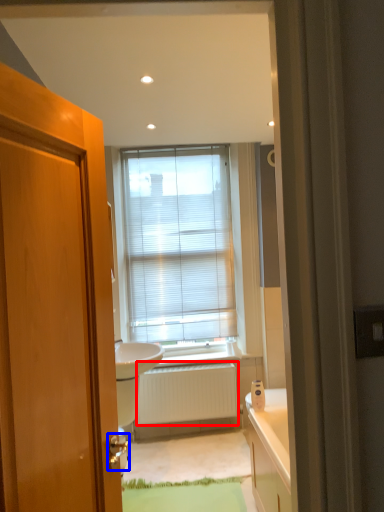
Question: Which object appears closest to the camera in this image, radiator (highlighted by a red box) or door handle (highlighted by a blue box)?

Choices:
 (A) radiator
 (B) door handle

Answer: (B)